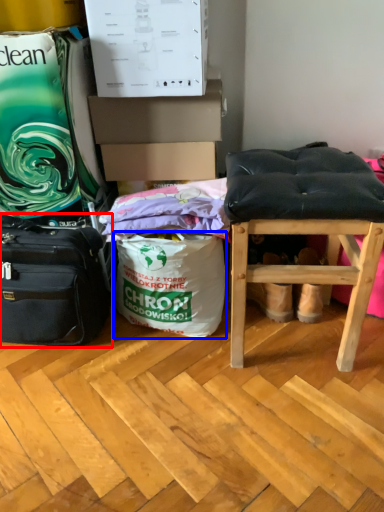
Question: Among these objects, which one is farthest to the camera, luggage and bags (highlighted by a red box) or shopping bag (highlighted by a blue box)?

Choices:
 (A) luggage and bags
 (B) shopping bag

Answer: (B)